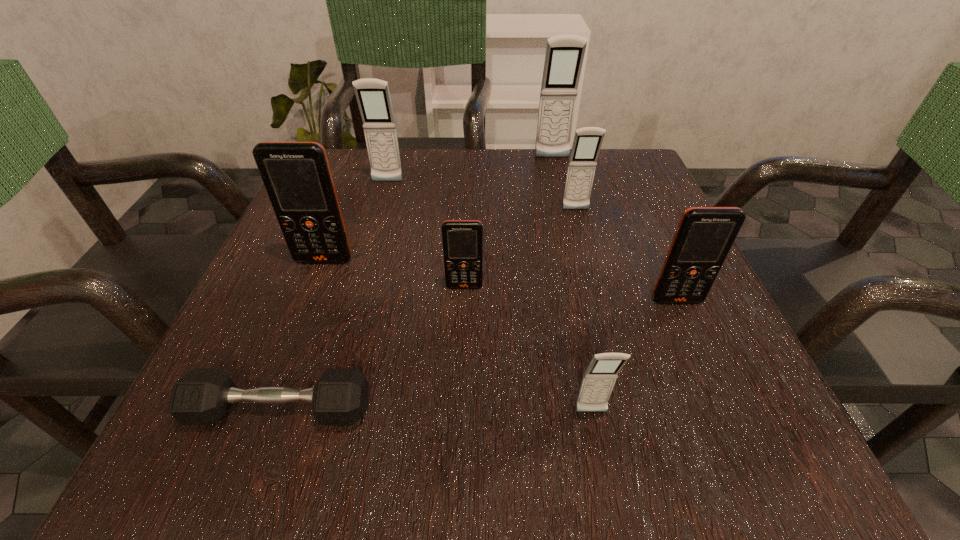
In the image, there is a desktop. Where is `vacant space at the near edge`? vacant space at the near edge is located at coordinates (406, 453).

Find the location of `free space at the left edge of the desktop`. free space at the left edge of the desktop is located at coordinates (370, 210).

I want to click on free space at the right edge of the desktop, so click(687, 368).

The image size is (960, 540). In the image, there is a desktop. In order to click on vacant space at the far left corner in this screenshot , I will do `click(340, 156)`.

The width and height of the screenshot is (960, 540). Find the location of `vacant space at the far right corner of the desktop`. vacant space at the far right corner of the desktop is located at coordinates (638, 176).

I want to click on vacant space at the near right corner of the desktop, so click(763, 475).

What are the coordinates of `free spot between the fourth nearest cellular telephone and the second smallest orange cellular telephone` in the screenshot? It's located at (500, 281).

You are a GUI agent. You are given a task and a screenshot of the screen. Output one action in this format:
    pyautogui.click(x=<x>, y=<y>)
    Task: Click on the empty space that is in between the shortest object and the rightmost object
    This screenshot has height=540, width=960.
    Given the screenshot: What is the action you would take?
    pyautogui.click(x=478, y=355)

Locate an element on the screen. The width and height of the screenshot is (960, 540). free space between the farthest cellular telephone and the smallest gray cellular telephone is located at coordinates (571, 285).

At what (x,y) coordinates should I click in order to perform the action: click on free space between the second nearest orange cellular telephone and the farthest object. Please return your answer as a coordinate pair (x, y). Looking at the image, I should click on (508, 222).